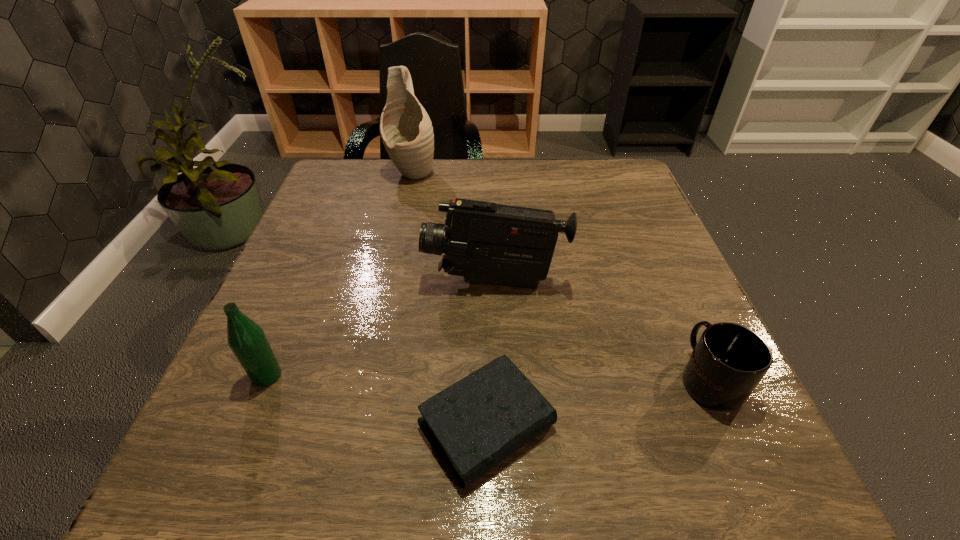
I want to click on vacant space that satisfies the following two spatial constraints: 1. with the handle on the side of the mug; 2. on the front-facing side of the fourth nearest object, so click(666, 282).

This screenshot has width=960, height=540. I want to click on vacant space that satisfies the following two spatial constraints: 1. with the handle on the side of the mug; 2. on the front-facing side of the camcorder, so 666,282.

Locate an element on the screen. The width and height of the screenshot is (960, 540). free space that satisfies the following two spatial constraints: 1. on the front-facing side of the second farthest object; 2. with the handle on the side of the second shortest object is located at coordinates (497, 379).

At what (x,y) coordinates should I click in order to perform the action: click on vacant region that satisfies the following two spatial constraints: 1. with the handle on the side of the rightmost object; 2. on the front-facing side of the second farthest object. Please return your answer as a coordinate pair (x, y). The height and width of the screenshot is (540, 960). Looking at the image, I should click on (666, 282).